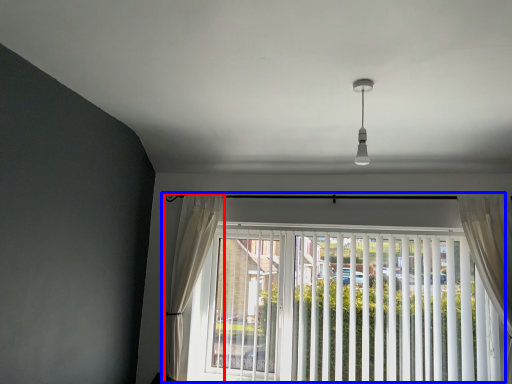
Question: Among these objects, which one is nearest to the camera, curtain (highlighted by a red box) or window (highlighted by a blue box)?

Choices:
 (A) curtain
 (B) window

Answer: (B)